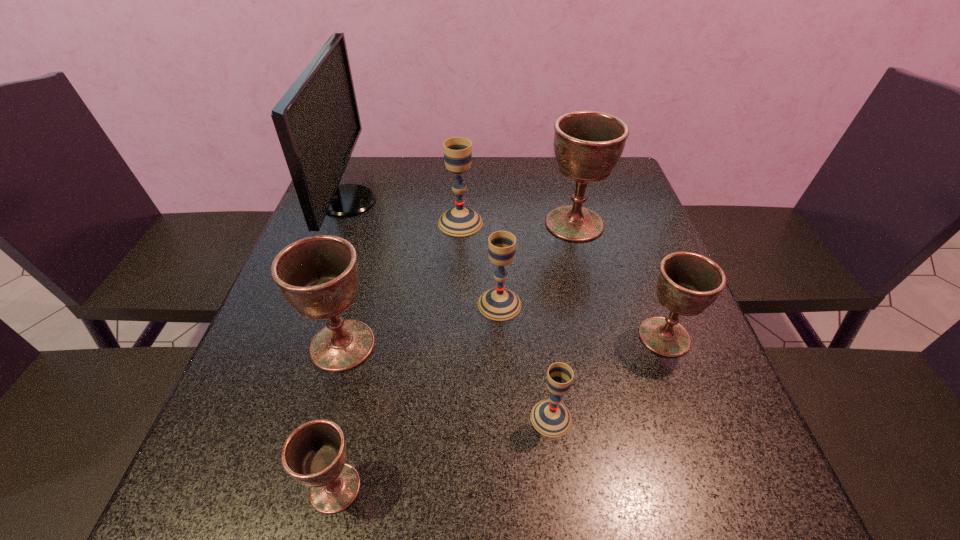
Image resolution: width=960 pixels, height=540 pixels. I want to click on free location that satisfies the following two spatial constraints: 1. on the front-facing side of the second smallest brown chalice; 2. on the left side of the black computer monitor, so click(x=297, y=336).

Where is `free space that satisfies the following two spatial constraints: 1. on the front-facing side of the tallest object; 2. on the back side of the nearest brown chalice`? free space that satisfies the following two spatial constraints: 1. on the front-facing side of the tallest object; 2. on the back side of the nearest brown chalice is located at coordinates (240, 488).

Find the location of a particular element. vacant area that satisfies the following two spatial constraints: 1. on the front-facing side of the second smallest gray chalice; 2. on the right side of the black computer monitor is located at coordinates (309, 304).

Locate an element on the screen. The width and height of the screenshot is (960, 540). free location that satisfies the following two spatial constraints: 1. on the back side of the second biggest gray chalice; 2. on the right side of the second biggest brown chalice is located at coordinates (354, 304).

Locate an element on the screen. Image resolution: width=960 pixels, height=540 pixels. free space that satisfies the following two spatial constraints: 1. on the front-facing side of the computer monitor; 2. on the left side of the second nearest gray chalice is located at coordinates (309, 304).

Locate an element on the screen. The height and width of the screenshot is (540, 960). free space that satisfies the following two spatial constraints: 1. on the back side of the nearest chalice; 2. on the left side of the second nearest gray chalice is located at coordinates (377, 304).